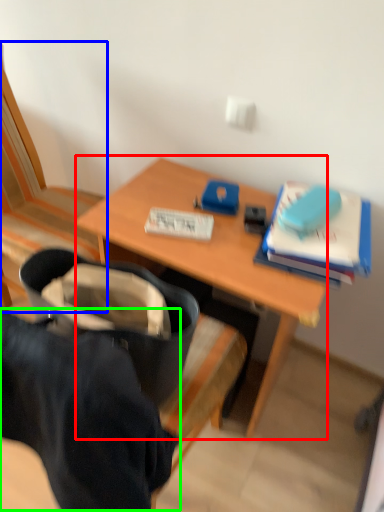
Question: Which is nearer to the desk (highlighted by a red box)? chair (highlighted by a blue box) or clothing (highlighted by a green box).

Choices:
 (A) chair
 (B) clothing

Answer: (A)